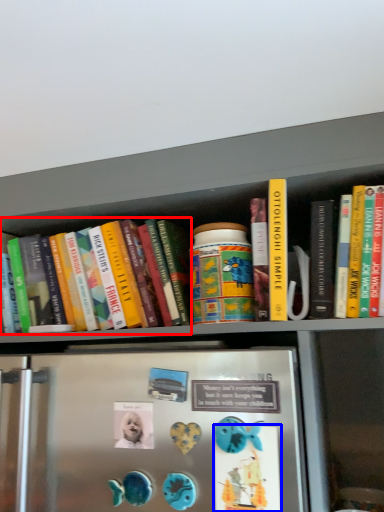
Question: Among these objects, which one is nearest to the camera, book (highlighted by a red box) or button (highlighted by a blue box)?

Choices:
 (A) book
 (B) button

Answer: (B)